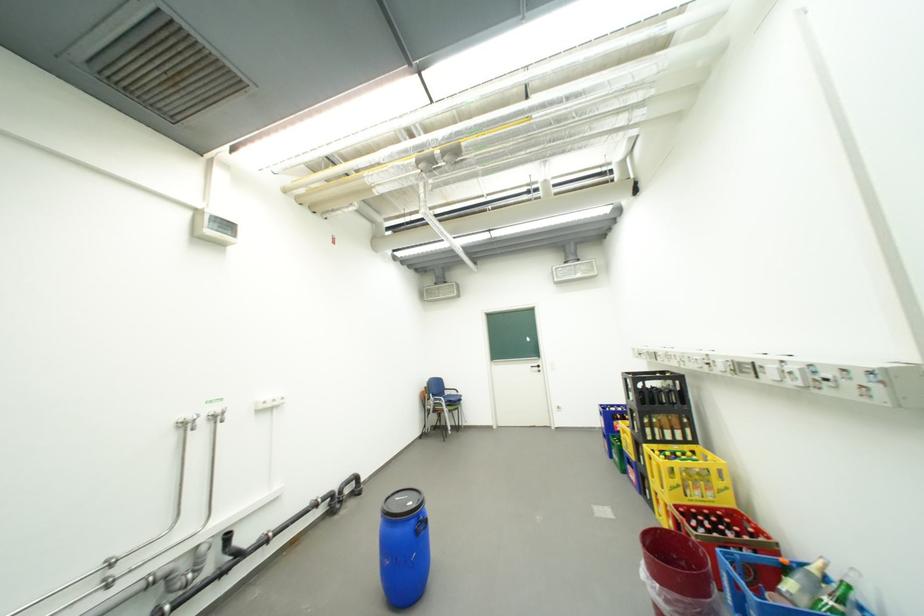
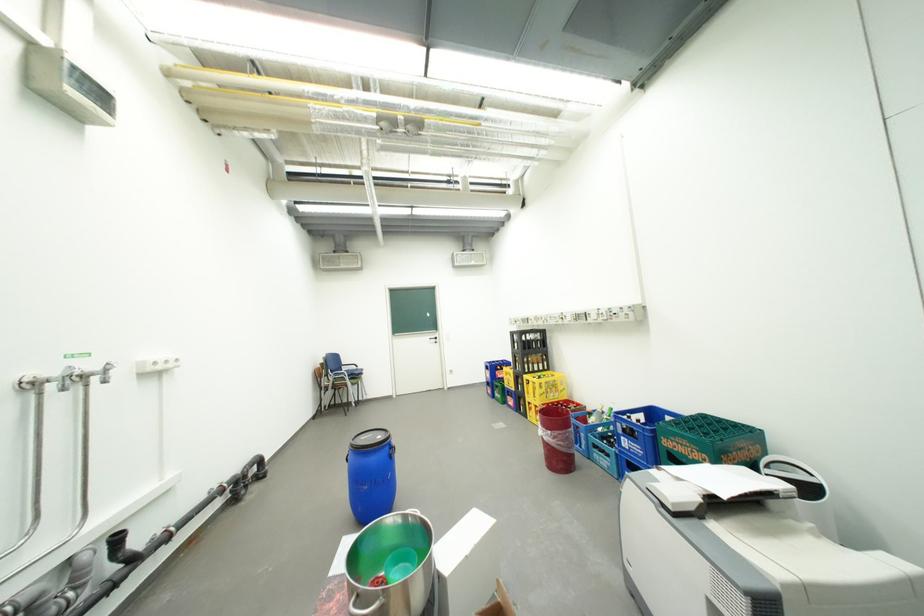
Question: The images are taken continuously from a first-person perspective. In which direction is your viewpoint rotating?

Choices:
 (A) Left
 (B) Right
 (C) Up
 (D) Down

Answer: (B)